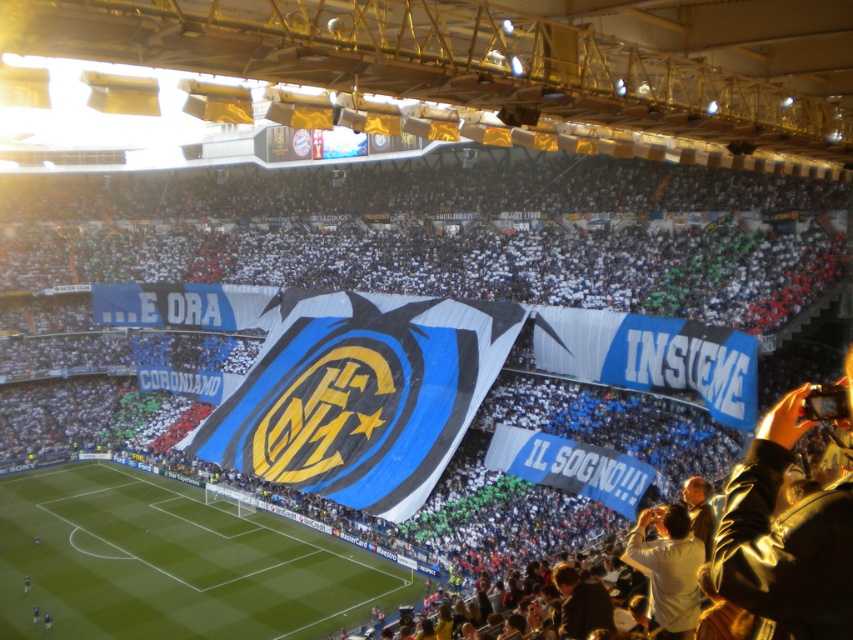
You are a photographer positioned at the edge of the field. You want to take a photo of the white matte shirt at lower right without the green grass football field at center blocking it. Is this possible?

The white matte shirt at lower right is behind the green grass football field at center, so it is already obscured by the field. Therefore, you cannot take a photo of the white matte shirt at lower right without the green grass football field at center blocking it.

You are a photographer standing at the edge of the green grass football field at center. You want to take a photo of the white matte shirt at lower right. Which direction should you move to get a better shot?

The green grass football field at center is positioned on the left side of white matte shirt at lower right, so you should move to the right to get a better shot of the white matte shirt at lower right.